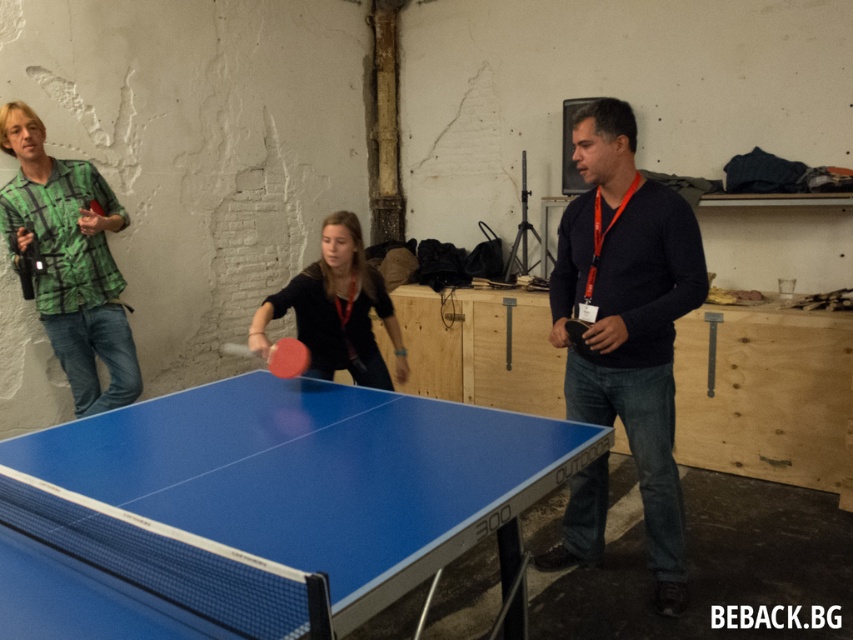
Question: Does matte pink paddle at center appear on the left side of rubber paddle at center?

Choices:
 (A) yes
 (B) no

Answer: (B)

Question: Which object is positioned closest to the matte pink paddle at center?

Choices:
 (A) black matte sweater at center
 (B) rubber paddle at center
 (C) matte black ping pong paddle at center

Answer: (B)

Question: Is matte pink paddle at center positioned at the back of rubber paddle at center?

Choices:
 (A) yes
 (B) no

Answer: (B)

Question: Is black matte sweater at center closer to camera compared to matte pink paddle at center?

Choices:
 (A) yes
 (B) no

Answer: (A)

Question: Which object is the closest to the black matte sweater at center?

Choices:
 (A) matte black ping pong paddle at center
 (B) rubber paddle at center
 (C) blue glossy table tennis table at center

Answer: (C)

Question: Which point is closer to the camera?

Choices:
 (A) (544, 468)
 (B) (78, 216)
 (C) (273, 358)

Answer: (A)